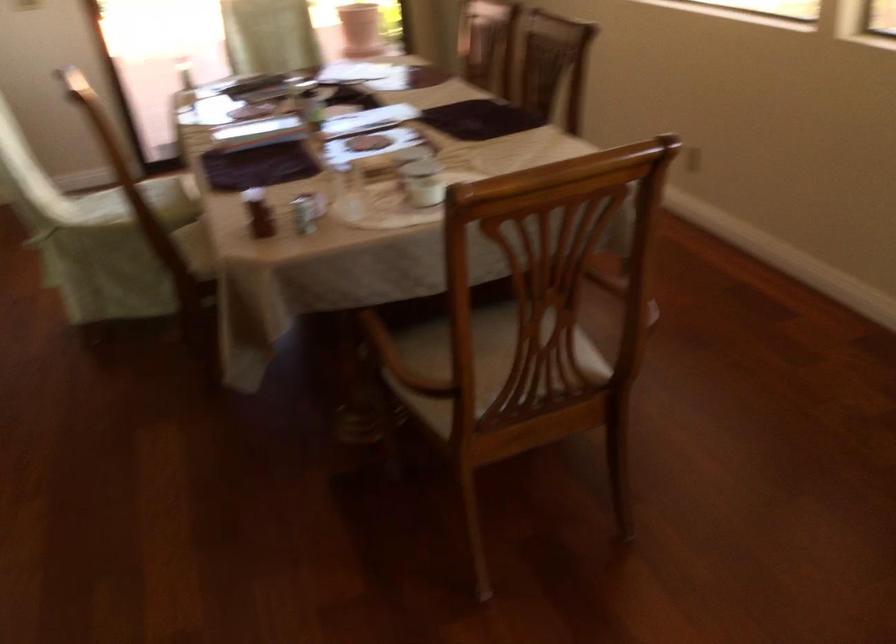
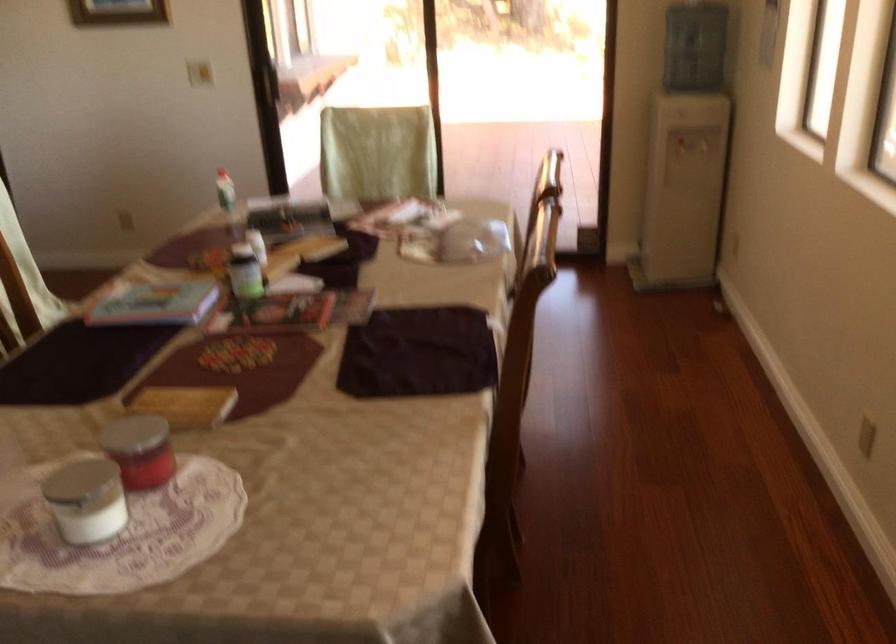
Find the pixel in the second image that matches (x=306, y=100) in the first image.

(245, 272)